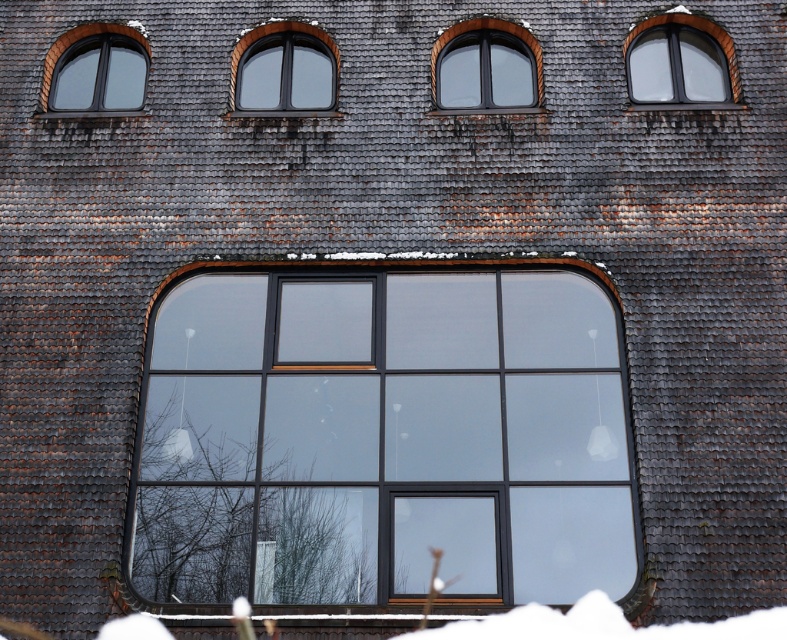
Question: Which object is the closest to the matte glass window at upper center?

Choices:
 (A) black glass window at center
 (B) matte black window at upper right

Answer: (B)

Question: Does matte black window at upper center appear over matte black window at upper left?

Choices:
 (A) yes
 (B) no

Answer: (B)

Question: Does matte glass window at upper center have a lesser width compared to matte black window at upper center?

Choices:
 (A) no
 (B) yes

Answer: (A)

Question: Is black glass window at center bigger than matte black window at upper right?

Choices:
 (A) no
 (B) yes

Answer: (B)

Question: Among these points, which one is farthest from the camera?

Choices:
 (A) (651, 68)
 (B) (486, 22)
 (C) (115, 45)

Answer: (C)

Question: Among these points, which one is farthest from the camera?

Choices:
 (A) (109, 35)
 (B) (434, 97)
 (C) (630, 51)

Answer: (A)